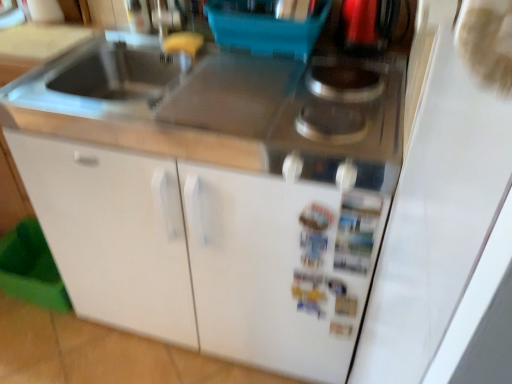
Question: Which direction should I rotate to look at white matte cabinet at center, which is the 1th cabinetry in right-to-left order, — up or down?

Choices:
 (A) up
 (B) down

Answer: (B)

Question: Is white matte cabinet at center, which is the 1th cabinetry in right-to-left order, turned away from white matte cabinet at lower left, which ranks as the 2th cabinetry in right-to-left order?

Choices:
 (A) no
 (B) yes

Answer: (A)

Question: From the image's perspective, does white matte cabinet at center, which is the 1th cabinetry in right-to-left order, appear higher than white matte cabinet at lower left, which ranks as the 2th cabinetry in right-to-left order?

Choices:
 (A) yes
 (B) no

Answer: (B)

Question: Is white matte cabinet at center, which is the 1th cabinetry in right-to-left order, smaller than white matte cabinet at lower left, which ranks as the 2th cabinetry in right-to-left order?

Choices:
 (A) yes
 (B) no

Answer: (A)

Question: Is white matte cabinet at center, marked as the 2th cabinetry in a left-to-right arrangement, outside white matte cabinet at lower left, acting as the 1th cabinetry starting from the left?

Choices:
 (A) yes
 (B) no

Answer: (A)

Question: From a real-world perspective, is white matte cabinet at center, which is the 1th cabinetry in right-to-left order, on white matte cabinet at lower left, acting as the 1th cabinetry starting from the left?

Choices:
 (A) yes
 (B) no

Answer: (B)

Question: Is white matte cabinet at center, which is the 1th cabinetry in right-to-left order, next to white matte cabinet at lower left, acting as the 1th cabinetry starting from the left?

Choices:
 (A) no
 (B) yes

Answer: (B)

Question: Is white matte cabinet at lower left, which ranks as the 2th cabinetry in right-to-left order, far away from metallic silver gas stove at upper right?

Choices:
 (A) no
 (B) yes

Answer: (A)

Question: From the image's perspective, is white matte cabinet at lower left, which ranks as the 2th cabinetry in right-to-left order, located beneath metallic silver gas stove at upper right?

Choices:
 (A) yes
 (B) no

Answer: (A)

Question: Can you confirm if white matte cabinet at lower left, acting as the 1th cabinetry starting from the left, is positioned to the right of metallic silver gas stove at upper right?

Choices:
 (A) no
 (B) yes

Answer: (A)

Question: Can you confirm if white matte cabinet at lower left, which ranks as the 2th cabinetry in right-to-left order, is smaller than metallic silver gas stove at upper right?

Choices:
 (A) yes
 (B) no

Answer: (B)

Question: Can you confirm if white matte cabinet at lower left, which ranks as the 2th cabinetry in right-to-left order, is positioned to the left of metallic silver gas stove at upper right?

Choices:
 (A) no
 (B) yes

Answer: (B)

Question: Is white matte cabinet at lower left, which ranks as the 2th cabinetry in right-to-left order, taller than metallic silver gas stove at upper right?

Choices:
 (A) yes
 (B) no

Answer: (A)

Question: From a real-world perspective, is metallic silver gas stove at upper right positioned under white matte cabinet at center, which is the 1th cabinetry in right-to-left order, based on gravity?

Choices:
 (A) no
 (B) yes

Answer: (A)